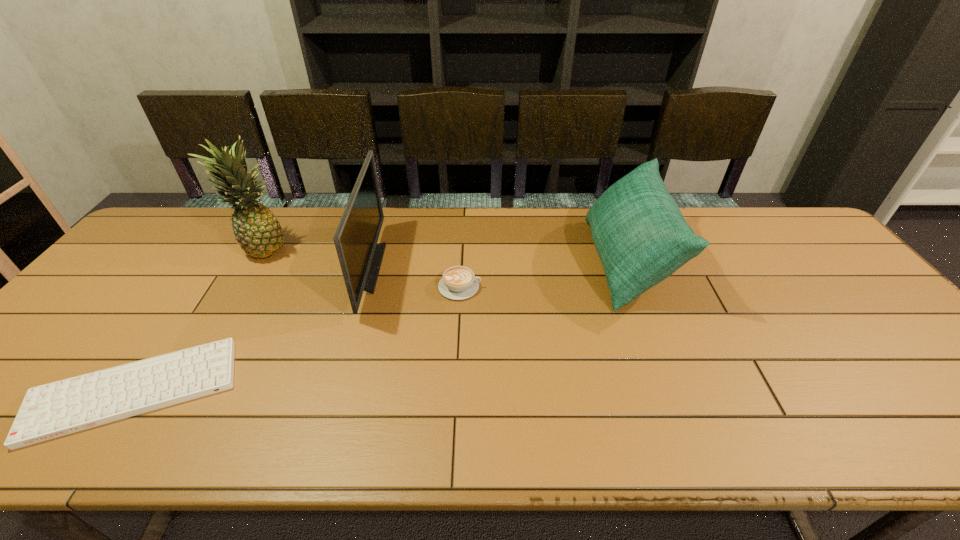
Find the location of a particular element. the tallest object is located at coordinates (256, 229).

Identify the location of monitor. The image size is (960, 540). (356, 237).

This screenshot has width=960, height=540. Find the location of `the rightmost object`. the rightmost object is located at coordinates (641, 237).

In order to click on the fourth object from left to right in this screenshot , I will do `click(458, 282)`.

This screenshot has width=960, height=540. What are the coordinates of `cappuccino` in the screenshot? It's located at (458, 282).

Locate an element on the screen. blank area located 0.190m on the front of the pineapple is located at coordinates (227, 310).

Identify the location of free spot located 0.360m on the screen side of the monitor. The image size is (960, 540). click(x=503, y=268).

Image resolution: width=960 pixels, height=540 pixels. In order to click on vacant space located on the front-facing side of the rightmost object in this screenshot , I will do `click(534, 262)`.

You are a GUI agent. You are given a task and a screenshot of the screen. Output one action in this format:
    pyautogui.click(x=<x>, y=<y>)
    Task: Click on the free location located 0.180m on the front-facing side of the rightmost object
    The height and width of the screenshot is (540, 960).
    Given the screenshot: What is the action you would take?
    pyautogui.click(x=527, y=262)

What are the coordinates of `vacant space located on the front-facing side of the rightmost object` in the screenshot? It's located at (460, 262).